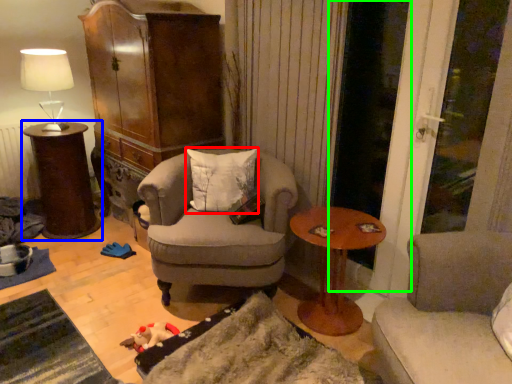
Question: Which object is the closest to the pillow (highlighted by a red box)? Choose among these: table (highlighted by a blue box) or screen door (highlighted by a green box).

Choices:
 (A) table
 (B) screen door

Answer: (B)